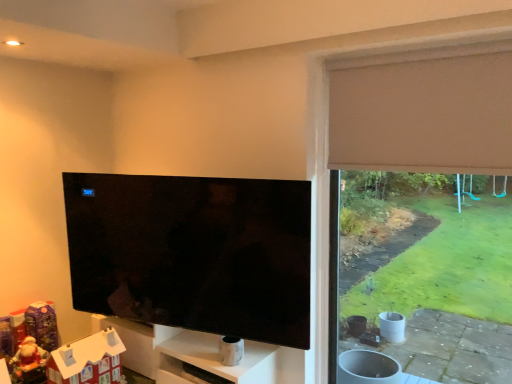
Locate an element on the screen. The image size is (512, 384). matte black tv at center is located at coordinates (193, 253).

You are a GUI agent. You are given a task and a screenshot of the screen. Output one action in this format:
    pyautogui.click(x=<x>, y=<y>)
    Task: Click on the beige fabric window frame at right
    This screenshot has height=384, width=512.
    Given the screenshot: What is the action you would take?
    pyautogui.click(x=420, y=107)

This screenshot has height=384, width=512. In order to click on matte black tv at center in this screenshot , I will do `click(193, 253)`.

From a real-world perspective, which is physically below, beige fabric curtain at upper right or matte black tv at center?

In real-world perspective, matte black tv at center is lower.

Is beige fabric curtain at upper right far away from matte black tv at center?

No, beige fabric curtain at upper right is not far from matte black tv at center.

Does beige fabric curtain at upper right have a lesser width compared to matte black tv at center?

Yes, beige fabric curtain at upper right is thinner than matte black tv at center.

Could you tell me if matte black tv at center is turned towards white marble shelf at lower center?

No, matte black tv at center is not aimed at white marble shelf at lower center.

Looking at this image, measure the distance between matte black tv at center and white marble shelf at lower center.

matte black tv at center and white marble shelf at lower center are 19.94 inches apart from each other.

Looking at their sizes, would you say matte black tv at center is wider or thinner than white marble shelf at lower center?

matte black tv at center is thinner than white marble shelf at lower center.

In the image, is matte black tv at center positioned in front of or behind white marble shelf at lower center?

In the image, matte black tv at center appears in front of white marble shelf at lower center.

Can you tell me how much white marble shelf at lower center and matte black tv at center differ in facing direction?

15.6 degrees.

Would you say white marble shelf at lower center is inside or outside matte black tv at center?

The correct answer is: outside.

Can you confirm if white marble shelf at lower center is thinner than matte black tv at center?

Incorrect, the width of white marble shelf at lower center is not less than that of matte black tv at center.

From a real-world perspective, which is physically above, white marble shelf at lower center or matte black tv at center?

matte black tv at center is physically above.

Where is `shelf that is in front of the white cardboard house at lower left`? Image resolution: width=512 pixels, height=384 pixels. shelf that is in front of the white cardboard house at lower left is located at coordinates (212, 361).

Is white cardboard house at lower left located outside white marble shelf at lower center?

Yes, white cardboard house at lower left is not within white marble shelf at lower center.

Can you confirm if white cardboard house at lower left is bigger than white marble shelf at lower center?

Incorrect, white cardboard house at lower left is not larger than white marble shelf at lower center.

Could you tell me if white cardboard house at lower left is turned towards white marble shelf at lower center?

No, white cardboard house at lower left is not turned towards white marble shelf at lower center.

Is point (161, 380) positioned in front of point (350, 155)?

No, (161, 380) is behind (350, 155).

How many degrees apart are the facing directions of white marble shelf at lower center and beige fabric curtain at upper right?

The angular difference between white marble shelf at lower center and beige fabric curtain at upper right is 0.371 degrees.

Is white marble shelf at lower center shorter than beige fabric curtain at upper right?

Correct, white marble shelf at lower center is not as tall as beige fabric curtain at upper right.

The image size is (512, 384). What are the coordinates of `shelf on the left of beige fabric curtain at upper right` in the screenshot? It's located at (212, 361).

Consider the image. From the image's perspective, would you say beige fabric window frame at right is shown under white cardboard house at lower left?

No.

In the scene shown: Between beige fabric window frame at right and white cardboard house at lower left, which one has larger width?

With larger width is white cardboard house at lower left.

Is beige fabric window frame at right inside or outside of white cardboard house at lower left?

beige fabric window frame at right exists outside the volume of white cardboard house at lower left.

You are a GUI agent. You are given a task and a screenshot of the screen. Output one action in this format:
    pyautogui.click(x=<x>, y=<y>)
    Task: Click on the shelf in front of the white cardboard house at lower left
    
    Given the screenshot: What is the action you would take?
    pyautogui.click(x=212, y=361)

Which point is more distant from viewer, (255, 357) or (51, 373)?

The point (255, 357) is farther from the camera.

Measure the distance from white marble shelf at lower center to white cardboard house at lower left.

A distance of 44.00 centimeters exists between white marble shelf at lower center and white cardboard house at lower left.

Based on their positions, is white marble shelf at lower center located to the left or right of white cardboard house at lower left?

Result: white marble shelf at lower center is to the right of white cardboard house at lower left.

You are a GUI agent. You are given a task and a screenshot of the screen. Output one action in this format:
    pyautogui.click(x=<x>, y=<y>)
    Task: Click on the curtain above the matte black tv at center (from a real-world perspective)
    This screenshot has width=512, height=384.
    Given the screenshot: What is the action you would take?
    pyautogui.click(x=424, y=111)

Identify the location of shelf that appears below the matte black tv at center (from the image's perspective). (212, 361).

From the image, which object appears to be nearer to matte black tv at center, beige fabric window frame at right or white marble shelf at lower center?

white marble shelf at lower center.

Which object lies further to the anchor point beige fabric curtain at upper right, beige fabric window frame at right or white marble shelf at lower center?

white marble shelf at lower center lies further to beige fabric curtain at upper right than the other object.

Estimate the real-world distances between objects in this image. Which object is closer to beige fabric curtain at upper right, matte black tv at center or white marble shelf at lower center?

matte black tv at center.

Considering their positions, is beige fabric window frame at right positioned further to matte black tv at center than white cardboard house at lower left?

Among the two, beige fabric window frame at right is located further to matte black tv at center.

Estimate the real-world distances between objects in this image. Which object is further from white marble shelf at lower center, matte black tv at center or beige fabric curtain at upper right?

The object further to white marble shelf at lower center is beige fabric curtain at upper right.

Which object lies nearer to the anchor point matte black tv at center, beige fabric curtain at upper right or white cardboard house at lower left?

white cardboard house at lower left lies closer to matte black tv at center than the other object.

Estimate the real-world distances between objects in this image. Which object is further from matte black tv at center, beige fabric window frame at right or beige fabric curtain at upper right?

Based on the image, beige fabric curtain at upper right appears to be further to matte black tv at center.

From the image, which object appears to be nearer to beige fabric window frame at right, matte black tv at center or white cardboard house at lower left?

matte black tv at center is positioned closer to the anchor beige fabric window frame at right.

The image size is (512, 384). Identify the location of shelf between white cardboard house at lower left and beige fabric window frame at right. (212, 361).

Identify the location of window frame that lies between beige fabric curtain at upper right and white marble shelf at lower center from top to bottom. point(420,107).

At what (x,y) coordinates should I click in order to perform the action: click on curtain situated between white cardboard house at lower left and beige fabric window frame at right from left to right. Please return your answer as a coordinate pair (x, y). Image resolution: width=512 pixels, height=384 pixels. Looking at the image, I should click on (424, 111).

Where is `shelf located between matte black tv at center and beige fabric window frame at right in the left-right direction`? The height and width of the screenshot is (384, 512). shelf located between matte black tv at center and beige fabric window frame at right in the left-right direction is located at coordinates (212, 361).